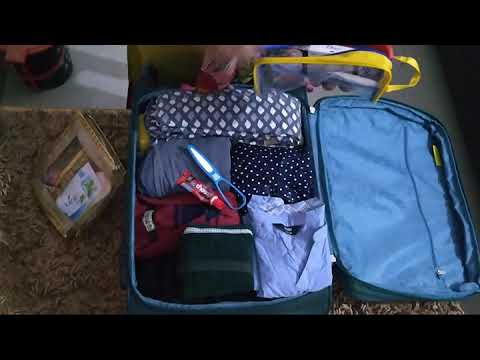
This screenshot has width=480, height=360. I want to click on floor, so click(x=430, y=93).